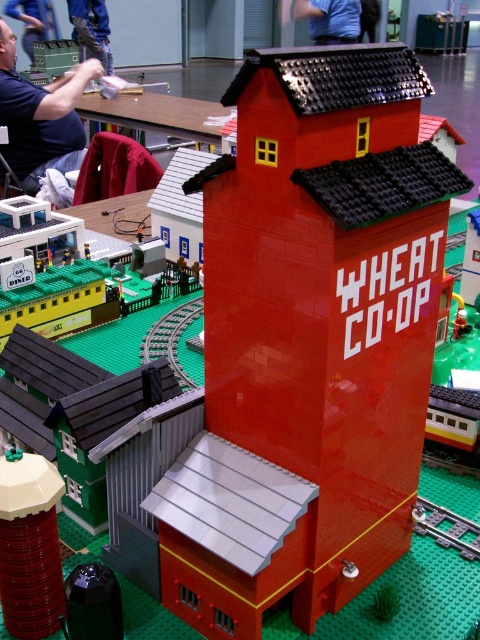
Is blue shirt at upper left to the left of blue fabric shirt at upper center from the viewer's perspective?

Correct, you'll find blue shirt at upper left to the left of blue fabric shirt at upper center.

Between point (84, 81) and point (311, 4), which one is positioned behind?

The point (311, 4) is more distant.

Measure the distance between point (9, 76) and camera.

10.50 feet

This screenshot has height=640, width=480. Identify the location of blue shirt at upper left. pos(40,113).